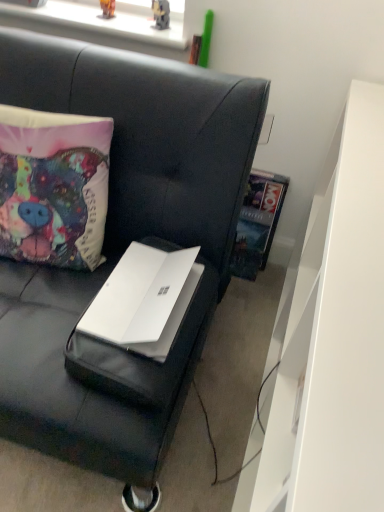
Question: Considering the relative sizes of matte fabric pillow at left and metallic plastic toy at upper center, the second toy in the left-to-right sequence, in the image provided, is matte fabric pillow at left taller than metallic plastic toy at upper center, the second toy in the left-to-right sequence,?

Choices:
 (A) no
 (B) yes

Answer: (B)

Question: Is metallic plastic toy at upper center, the 1th toy positioned from the right, a part of matte fabric pillow at left?

Choices:
 (A) no
 (B) yes

Answer: (A)

Question: Is matte fabric pillow at left aimed at metallic plastic toy at upper center, the 1th toy positioned from the right?

Choices:
 (A) yes
 (B) no

Answer: (B)

Question: Are matte fabric pillow at left and metallic plastic toy at upper center, the 1th toy positioned from the right, far apart?

Choices:
 (A) no
 (B) yes

Answer: (A)

Question: Considering the relative sizes of matte fabric pillow at left and metallic plastic toy at upper center, the 1th toy positioned from the right, in the image provided, is matte fabric pillow at left shorter than metallic plastic toy at upper center, the 1th toy positioned from the right,?

Choices:
 (A) yes
 (B) no

Answer: (B)

Question: From a real-world perspective, relative to metallic plastic toy at upper center, the 1th toy positioned from the right, is white matte laptop at center vertically above or below?

Choices:
 (A) above
 (B) below

Answer: (B)

Question: Is white matte laptop at center wider or thinner than metallic plastic toy at upper center, the 1th toy positioned from the right?

Choices:
 (A) thin
 (B) wide

Answer: (B)

Question: Is white matte laptop at center inside or outside of metallic plastic toy at upper center, the 1th toy positioned from the right?

Choices:
 (A) outside
 (B) inside

Answer: (A)

Question: Is white matte laptop at center taller or shorter than metallic plastic toy at upper center, the second toy in the left-to-right sequence?

Choices:
 (A) short
 (B) tall

Answer: (B)

Question: Is point (163, 17) closer or farther from the camera than point (18, 381)?

Choices:
 (A) farther
 (B) closer

Answer: (A)

Question: From the image's perspective, relative to white matte laptop at center, is metallic plastic toy at upper center, the second toy in the left-to-right sequence, above or below?

Choices:
 (A) below
 (B) above

Answer: (B)

Question: From a real-world perspective, is metallic plastic toy at upper center, the second toy in the left-to-right sequence, physically located above or below white matte laptop at center?

Choices:
 (A) above
 (B) below

Answer: (A)

Question: Relative to white matte laptop at center, is metallic plastic toy at upper center, the second toy in the left-to-right sequence, in front or behind?

Choices:
 (A) behind
 (B) front

Answer: (A)

Question: From the image's perspective, relative to white matte dresser at right, is white matte laptop at center above or below?

Choices:
 (A) above
 (B) below

Answer: (A)

Question: Based on their positions, is white matte laptop at center located to the left or right of white matte dresser at right?

Choices:
 (A) left
 (B) right

Answer: (A)